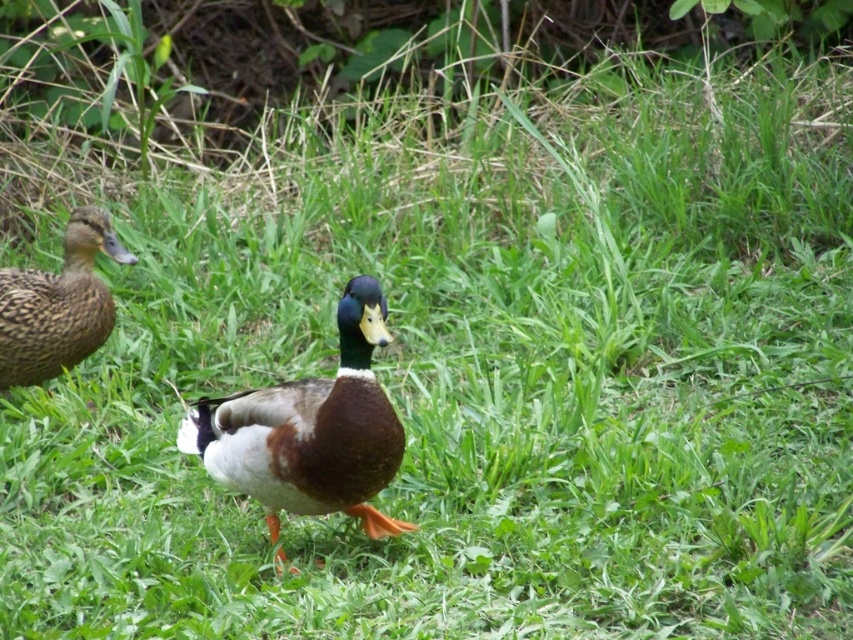
How much distance is there between shiny brown duck at center and brown speckled feathers at left?

shiny brown duck at center is 4.22 feet away from brown speckled feathers at left.

Is shiny brown duck at center to the left of brown speckled feathers at left from the viewer's perspective?

Incorrect, shiny brown duck at center is not on the left side of brown speckled feathers at left.

You are a GUI agent. You are given a task and a screenshot of the screen. Output one action in this format:
    pyautogui.click(x=<x>, y=<y>)
    Task: Click on the shiny brown duck at center
    This screenshot has height=640, width=853.
    Given the screenshot: What is the action you would take?
    pyautogui.click(x=310, y=429)